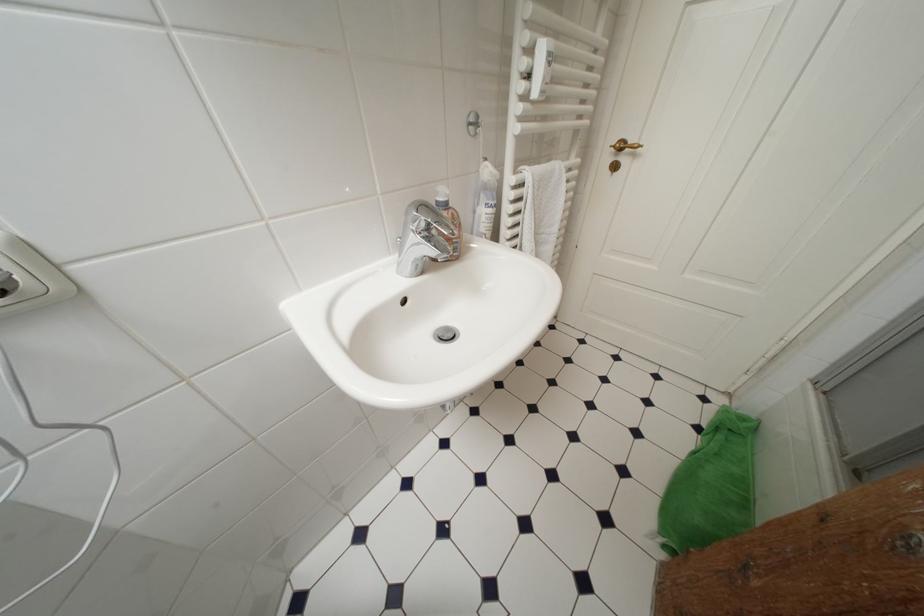
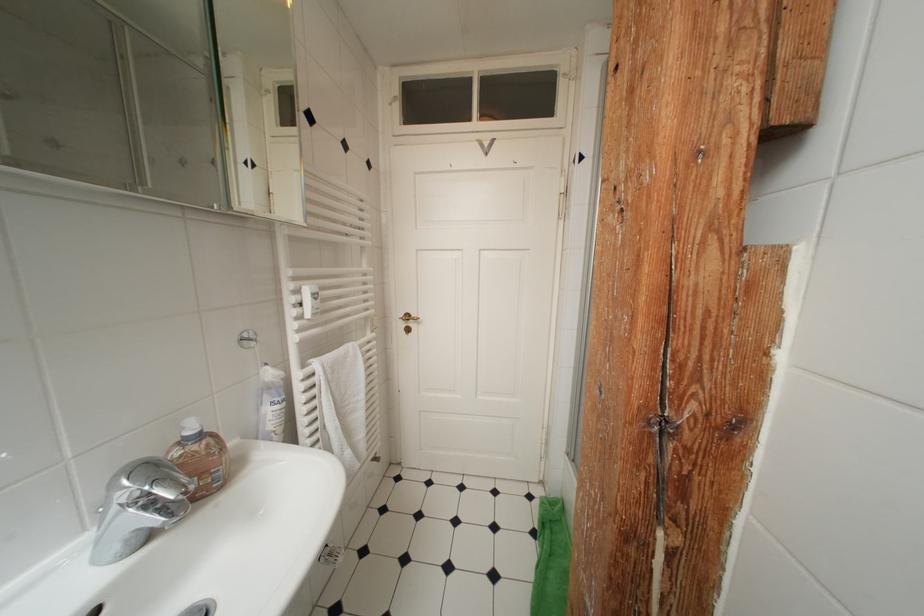
The point at (627,148) is marked in the first image. Where is the corresponding point in the second image?

(415, 320)